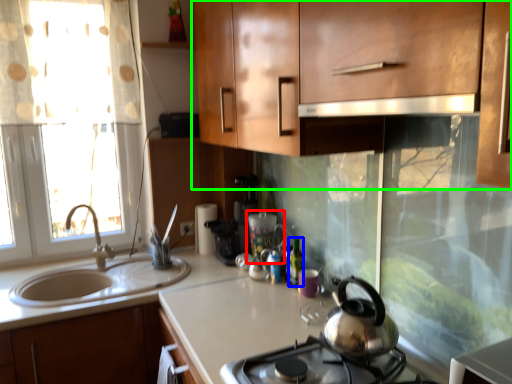
Question: Estimate the real-world distances between objects in this image. Which object is farther from appliance (highlighted by a red box), bottle (highlighted by a blue box) or cabinetry (highlighted by a green box)?

Choices:
 (A) bottle
 (B) cabinetry

Answer: (B)